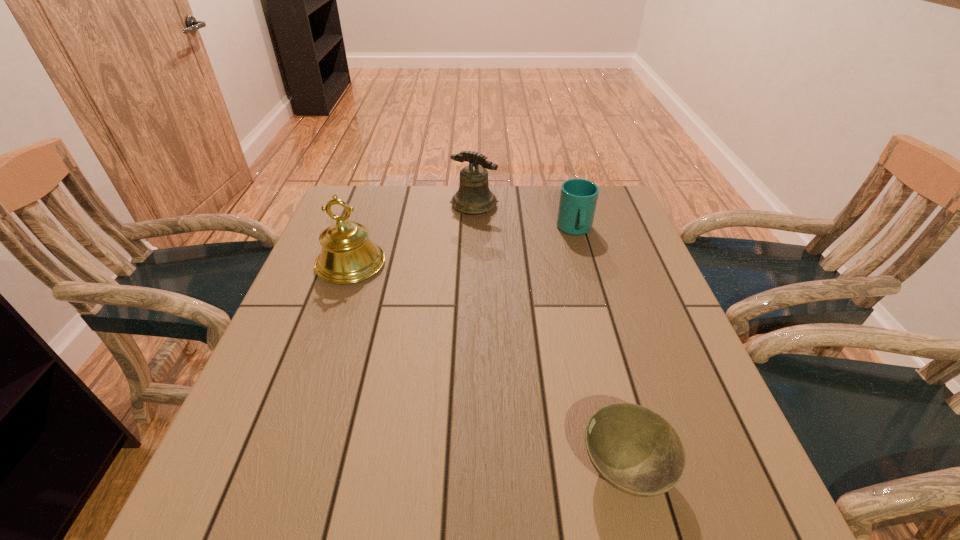
Where is `the left bell`? the left bell is located at coordinates (348, 255).

I want to click on the leftmost object, so click(348, 255).

Image resolution: width=960 pixels, height=540 pixels. Identify the location of the right bell. (474, 196).

Image resolution: width=960 pixels, height=540 pixels. Find the location of `the farther bell`. the farther bell is located at coordinates (474, 196).

Where is `the second shortest object`? The image size is (960, 540). the second shortest object is located at coordinates (578, 197).

You are a GUI agent. You are given a task and a screenshot of the screen. Output one action in this format:
    pyautogui.click(x=<x>, y=<y>)
    Task: Click on the shortest object
    
    Given the screenshot: What is the action you would take?
    pyautogui.click(x=637, y=451)

The width and height of the screenshot is (960, 540). I want to click on the nearest object, so click(x=637, y=451).

The image size is (960, 540). What are the coordinates of `vacant space located 0.260m on the back of the nearer bell` in the screenshot? It's located at (375, 194).

Where is `vacant point located 0.390m on the front of the right bell`? Image resolution: width=960 pixels, height=540 pixels. vacant point located 0.390m on the front of the right bell is located at coordinates (472, 313).

Where is `vacant space located on the handle side of the second shortest object`? The height and width of the screenshot is (540, 960). vacant space located on the handle side of the second shortest object is located at coordinates (598, 312).